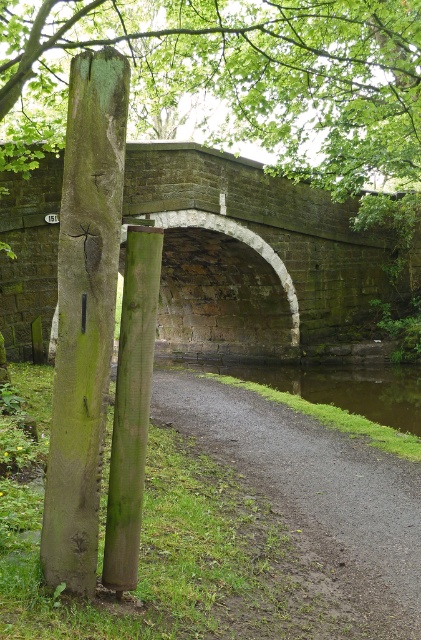
Question: Which object is farther from the camera taking this photo?

Choices:
 (A) green mossy wood pole at left
 (B) stone arch bridge at center
 (C) green mossy post at center
 (D) gray gravel path at lower center

Answer: (B)

Question: Estimate the real-world distances between objects in this image. Which object is closer to the green mossy post at center?

Choices:
 (A) green mossy wood pole at left
 (B) gray gravel path at lower center

Answer: (A)

Question: Can you confirm if green mossy wood pole at left is smaller than green mossy post at center?

Choices:
 (A) yes
 (B) no

Answer: (B)

Question: Is stone arch bridge at center positioned behind gray gravel path at lower center?

Choices:
 (A) yes
 (B) no

Answer: (A)

Question: From the image, what is the correct spatial relationship of stone arch bridge at center in relation to green mossy post at center?

Choices:
 (A) above
 (B) below

Answer: (A)

Question: Estimate the real-world distances between objects in this image. Which object is closer to the green mossy post at center?

Choices:
 (A) gray gravel path at lower center
 (B) stone arch bridge at center

Answer: (A)